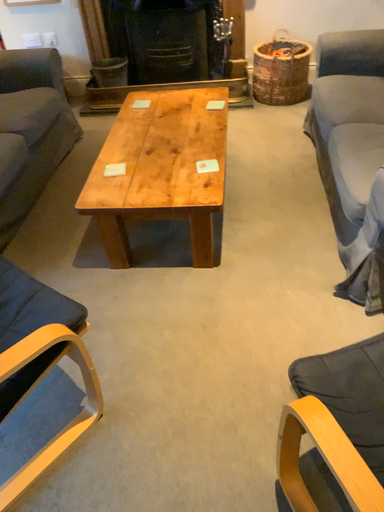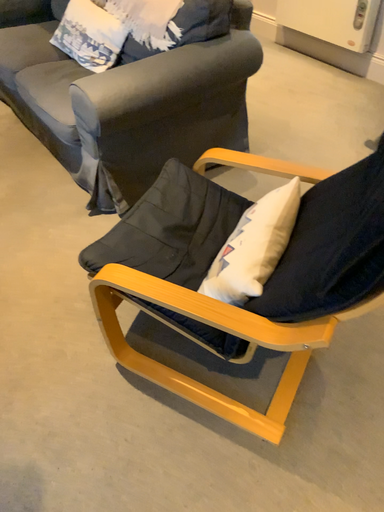
Question: How did the camera likely rotate when shooting the video?

Choices:
 (A) rotated left
 (B) rotated right

Answer: (B)